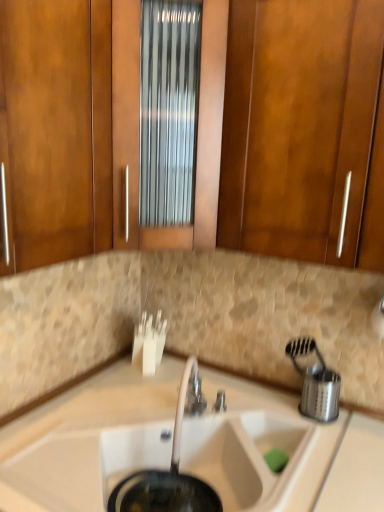
Find the location of a particular element. This screenshot has height=512, width=384. silver metallic faucet at center is located at coordinates (220, 402).

What do you see at coordinates (57, 127) in the screenshot?
I see `matte wood cabinet at upper center, which appears as the 1th cabinetry when viewed from the left` at bounding box center [57, 127].

What do you see at coordinates (204, 460) in the screenshot? The image size is (384, 512). I see `white matte sink at center` at bounding box center [204, 460].

What are the coordinates of `white matte sink at center` in the screenshot? It's located at (204, 460).

The width and height of the screenshot is (384, 512). Find the location of `white matte sink at center`. white matte sink at center is located at coordinates (189, 319).

Considering the points (146, 479) and (315, 413), which point is in front, point (146, 479) or point (315, 413)?

Point (146, 479)

Is white matte sink at center not near stainless steel strainer at right?

No, white matte sink at center is in close proximity to stainless steel strainer at right.

From the image's perspective, would you say white matte sink at center is positioned over stainless steel strainer at right?

No.

Can you confirm if white matte sink at center is smaller than stainless steel strainer at right?

No.

In terms of width, does white ceramic faucet at center look wider or thinner when compared to matte wood cabinet at upper center, which appears as the 1th cabinetry when viewed from the left?

Clearly, white ceramic faucet at center has less width compared to matte wood cabinet at upper center, which appears as the 1th cabinetry when viewed from the left.

Can you confirm if white ceramic faucet at center is taller than matte wood cabinet at upper center, which appears as the 1th cabinetry when viewed from the left?

No, white ceramic faucet at center is not taller than matte wood cabinet at upper center, which appears as the 1th cabinetry when viewed from the left.

Considering the points (177, 435) and (5, 159), which point is behind, point (177, 435) or point (5, 159)?

The point (177, 435) is farther from the camera.

Considering the relative sizes of stainless steel strainer at right and wooden cabinet at center, the second cabinetry in the left-to-right sequence, in the image provided, is stainless steel strainer at right bigger than wooden cabinet at center, the second cabinetry in the left-to-right sequence,?

Actually, stainless steel strainer at right might be smaller than wooden cabinet at center, the second cabinetry in the left-to-right sequence.

Identify the location of appliance located behind the wooden cabinet at center, marked as the 1th cabinetry in a right-to-left arrangement. (315, 382).

Can you confirm if stainless steel strainer at right is positioned to the left of wooden cabinet at center, marked as the 1th cabinetry in a right-to-left arrangement?

Incorrect, stainless steel strainer at right is not on the left side of wooden cabinet at center, marked as the 1th cabinetry in a right-to-left arrangement.

From the image's perspective, is stainless steel strainer at right located above or below wooden cabinet at center, marked as the 1th cabinetry in a right-to-left arrangement?

From the image's perspective, stainless steel strainer at right appears below wooden cabinet at center, marked as the 1th cabinetry in a right-to-left arrangement.

What's the angular difference between stainless steel strainer at right and white ceramic faucet at center's facing directions?

The angular difference between stainless steel strainer at right and white ceramic faucet at center is 22.1 degrees.

Is point (316, 353) in front of point (186, 388)?

No, (316, 353) is further to viewer.

Is stainless steel strainer at right located outside white ceramic faucet at center?

stainless steel strainer at right lies outside white ceramic faucet at center's area.

Considering the sizes of objects stainless steel strainer at right and white ceramic faucet at center in the image provided, who is thinner, stainless steel strainer at right or white ceramic faucet at center?

With smaller width is stainless steel strainer at right.

Can you confirm if white ceramic faucet at center is bigger than wooden cabinet at center, marked as the 1th cabinetry in a right-to-left arrangement?

Incorrect, white ceramic faucet at center is not larger than wooden cabinet at center, marked as the 1th cabinetry in a right-to-left arrangement.

Can you tell me how much white ceramic faucet at center and wooden cabinet at center, the second cabinetry in the left-to-right sequence, differ in facing direction?

The angle between the facing direction of white ceramic faucet at center and the facing direction of wooden cabinet at center, the second cabinetry in the left-to-right sequence, is 21.9 degrees.

Based on their positions, is white ceramic faucet at center located to the left or right of wooden cabinet at center, marked as the 1th cabinetry in a right-to-left arrangement?

Clearly, white ceramic faucet at center is on the right of wooden cabinet at center, marked as the 1th cabinetry in a right-to-left arrangement, in the image.

From the image's perspective, relative to wooden cabinet at center, the second cabinetry in the left-to-right sequence, is white ceramic faucet at center above or below?

From the image's perspective, white ceramic faucet at center appears below wooden cabinet at center, the second cabinetry in the left-to-right sequence.

Can you confirm if white ceramic faucet at center is positioned to the right of silver metallic faucet at center?

No.

Is white ceramic faucet at center far from silver metallic faucet at center?

No, there isn't a large distance between white ceramic faucet at center and silver metallic faucet at center.

Does white ceramic faucet at center lie behind silver metallic faucet at center?

No, white ceramic faucet at center is closer to the viewer.

I want to click on faucet located behind the white ceramic faucet at center, so click(220, 402).

Is stainless steel strainer at right facing towards silver metallic faucet at center?

No, stainless steel strainer at right is not turned towards silver metallic faucet at center.

Between stainless steel strainer at right and silver metallic faucet at center, which one has larger size?

stainless steel strainer at right.

Based on the photo, which object is wider, stainless steel strainer at right or silver metallic faucet at center?

stainless steel strainer at right.

You are a GUI agent. You are given a task and a screenshot of the screen. Output one action in this format:
    pyautogui.click(x=<x>, y=<y>)
    Task: Click on the appliance located above the white matte sink at center (from a real-world perspective)
    The width and height of the screenshot is (384, 512).
    Given the screenshot: What is the action you would take?
    pyautogui.click(x=315, y=382)

Locate an element on the screen. tap below the matte wood cabinet at upper center, placed as the 2th cabinetry when sorted from right to left (from the image's perspective) is located at coordinates (187, 405).

In the scene shown: Which object lies nearer to the anchor point white ceramic faucet at center, white matte sink at center or white matte sink at center?

white matte sink at center.

From the image, which object appears to be farther from wooden cabinet at center, marked as the 1th cabinetry in a right-to-left arrangement, matte wood cabinet at upper center, which appears as the 1th cabinetry when viewed from the left, or silver metallic faucet at center?

silver metallic faucet at center lies further to wooden cabinet at center, marked as the 1th cabinetry in a right-to-left arrangement, than the other object.

Based on their spatial positions, is wooden cabinet at center, marked as the 1th cabinetry in a right-to-left arrangement, or white matte sink at center closer to silver metallic faucet at center?

white matte sink at center is closer to silver metallic faucet at center.

Based on their spatial positions, is silver metallic faucet at center or white matte sink at center closer to wooden cabinet at center, marked as the 1th cabinetry in a right-to-left arrangement?

white matte sink at center is closer to wooden cabinet at center, marked as the 1th cabinetry in a right-to-left arrangement.

When comparing their distances from wooden cabinet at center, the second cabinetry in the left-to-right sequence, does white matte sink at center or white matte sink at center seem further?

The object further to wooden cabinet at center, the second cabinetry in the left-to-right sequence, is white matte sink at center.

Which object lies nearer to the anchor point wooden cabinet at center, marked as the 1th cabinetry in a right-to-left arrangement, stainless steel strainer at right or white matte sink at center?

stainless steel strainer at right is closer to wooden cabinet at center, marked as the 1th cabinetry in a right-to-left arrangement.

When comparing their distances from white matte sink at center, does matte wood cabinet at upper center, which appears as the 1th cabinetry when viewed from the left, or wooden cabinet at center, the second cabinetry in the left-to-right sequence, seem further?

Based on the image, matte wood cabinet at upper center, which appears as the 1th cabinetry when viewed from the left, appears to be further to white matte sink at center.

Considering their positions, is wooden cabinet at center, marked as the 1th cabinetry in a right-to-left arrangement, positioned further to white matte sink at center than silver metallic faucet at center?

wooden cabinet at center, marked as the 1th cabinetry in a right-to-left arrangement, is positioned further to the anchor white matte sink at center.

Identify the location of tap between white matte sink at center and stainless steel strainer at right from front to back. (187, 405).

Locate an element on the screen. This screenshot has width=384, height=512. tap that lies between wooden cabinet at center, marked as the 1th cabinetry in a right-to-left arrangement, and silver metallic faucet at center from top to bottom is located at coordinates (187, 405).

Identify the location of tap between wooden cabinet at center, marked as the 1th cabinetry in a right-to-left arrangement, and white matte sink at center in the up-down direction. (187, 405).

Where is `faucet between matte wood cabinet at upper center, which appears as the 1th cabinetry when viewed from the left, and white matte sink at center vertically`? The width and height of the screenshot is (384, 512). faucet between matte wood cabinet at upper center, which appears as the 1th cabinetry when viewed from the left, and white matte sink at center vertically is located at coordinates (220, 402).